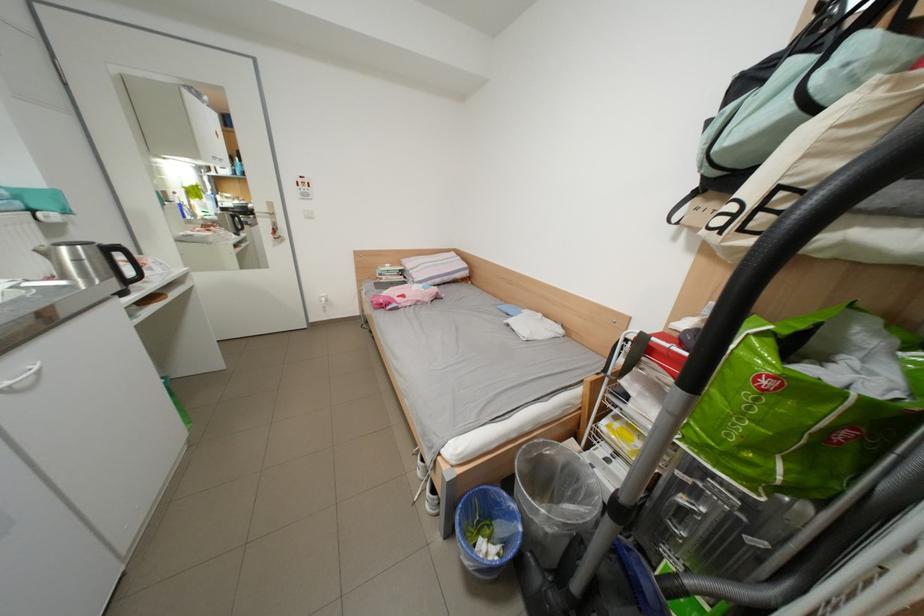
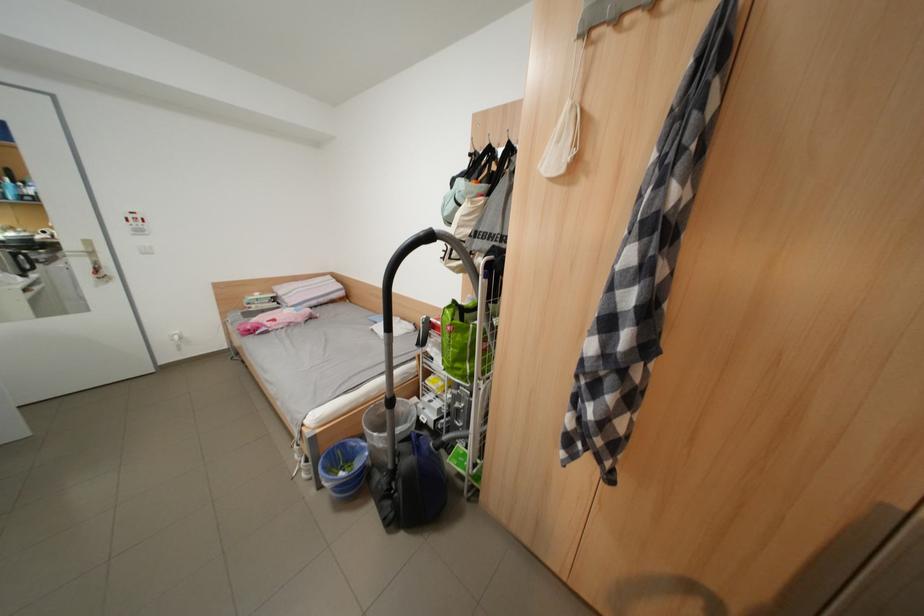
The point at (311, 180) is marked in the first image. Where is the corresponding point in the second image?

(142, 217)